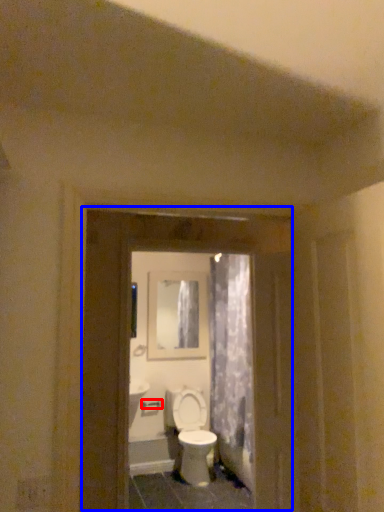
Question: Which object appears closest to the camera in this image, door handle (highlighted by a red box) or screen door (highlighted by a blue box)?

Choices:
 (A) door handle
 (B) screen door

Answer: (B)